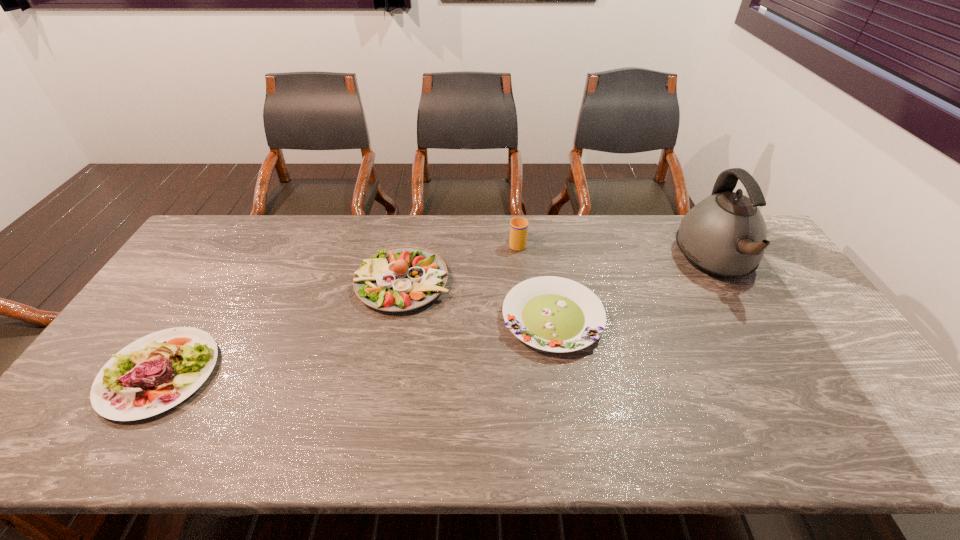
This screenshot has width=960, height=540. Identify the location of vacant point located between the kettle and the second salad plate from right to left. (560, 272).

The height and width of the screenshot is (540, 960). Identify the location of free space between the fourth tallest object and the shortest object. (356, 346).

Locate an element on the screen. vacant space that is in between the tallest salad plate and the shortest salad plate is located at coordinates (478, 300).

At what (x,y) coordinates should I click in order to perform the action: click on blank region between the shortest object and the leftmost salad plate. Please return your answer as a coordinate pair (x, y). Image resolution: width=960 pixels, height=540 pixels. Looking at the image, I should click on (356, 346).

Locate an element on the screen. free space between the second tallest salad plate and the second object from left to right is located at coordinates (281, 328).

The width and height of the screenshot is (960, 540). I want to click on free space between the fourth object from right to left and the tallest object, so click(560, 272).

What are the coordinates of `free space between the cup and the second salad plate from left to right` in the screenshot? It's located at (460, 263).

Where is `free area in between the second shortest salad plate and the tallest object`? free area in between the second shortest salad plate and the tallest object is located at coordinates (438, 318).

Select which object appears as the second closest to the second salad plate from left to right. Please provide its 2D coordinates. Your answer should be formatted as a tuple, i.e. [(x, y)], where the tuple contains the x and y coordinates of a point satisfying the conditions above.

[(518, 226)]

Identify the location of the fourth closest object relative to the kettle. point(129,386).